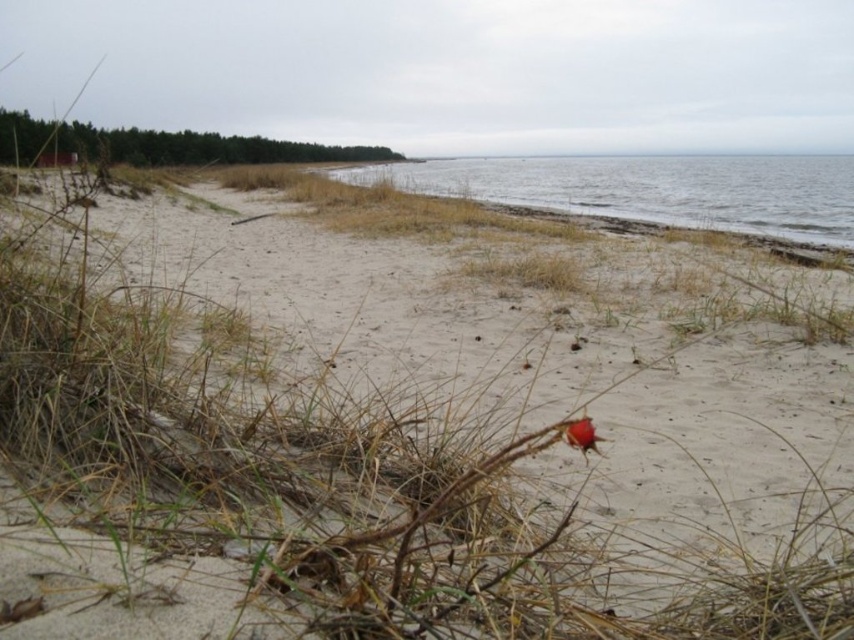
You are standing on the light beige sand at center and want to reach the clear water at lower right. Which direction should you move to get to the water?

You should move downward towards the clear water at lower right because the light beige sand at center is positioned under the clear water at lower right, indicating it is located above it in the image.

You are standing on the beach and want to place a small flag at the exact location of the point marked as point (404, 442). According to the scene description, what will the flag be placed on?

The flag will be placed on the light beige sand at center located at point (404, 442).